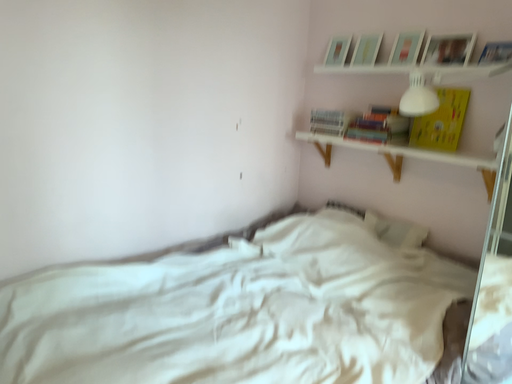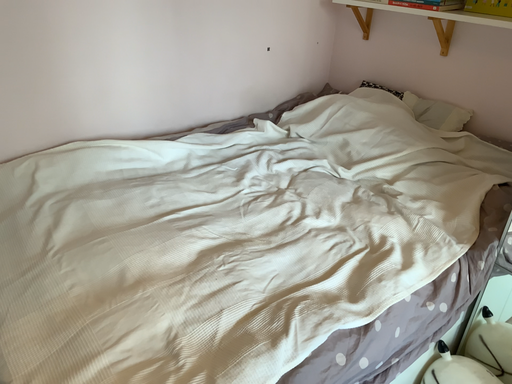
Question: Which way did the camera rotate in the video?

Choices:
 (A) rotated downward
 (B) rotated upward

Answer: (A)